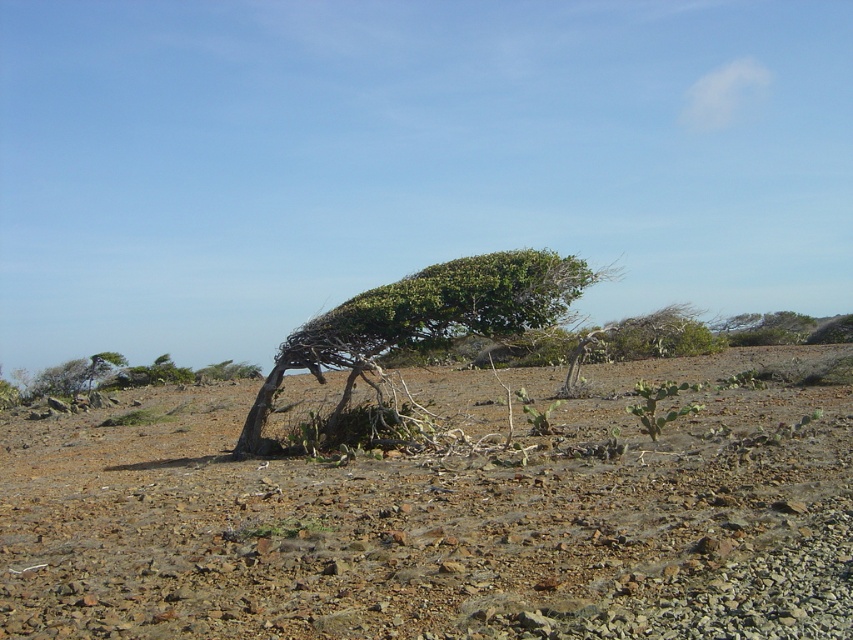
You are standing at the edge of a desert and see the brown rocky dirt field at center and the green leafy tree at center. Which object is located to the right of the other?

The brown rocky dirt field at center is located to the right of the green leafy tree at center.

You are standing at the origin point in this arid landscape. Where is the brown rocky dirt field at center located in terms of coordinates?

The brown rocky dirt field at center is located at coordinates point (440, 520).